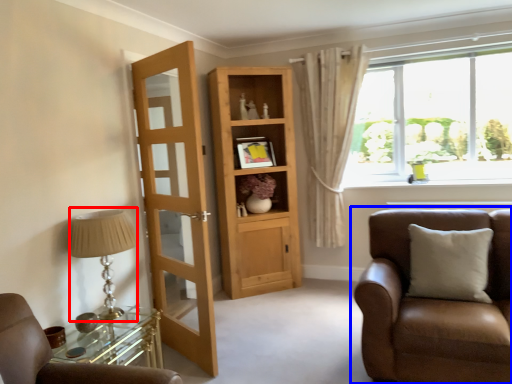
Question: Which of the following is the closest to the observer, table lamp (highlighted by a red box) or chair (highlighted by a blue box)?

Choices:
 (A) table lamp
 (B) chair

Answer: (B)